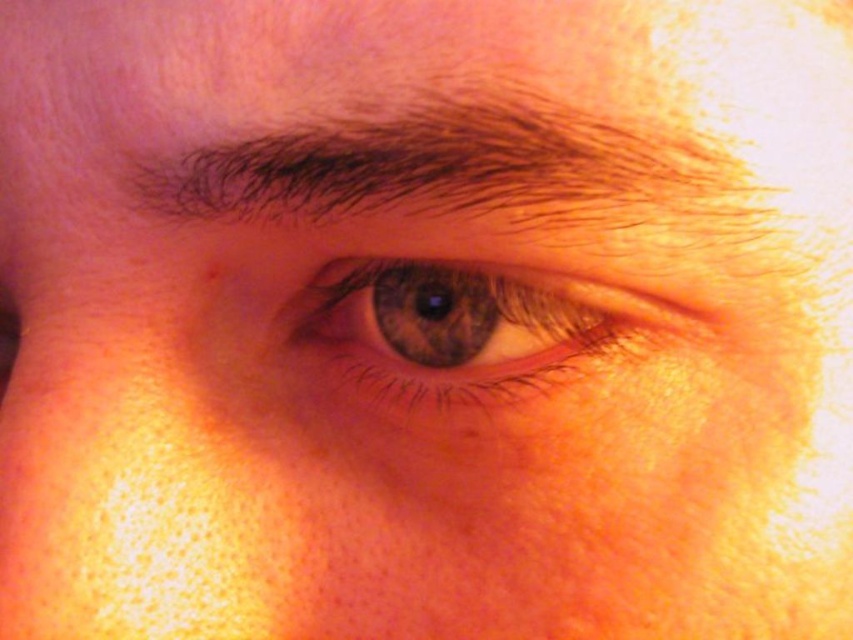
Question: Estimate the real-world distances between objects in this image. Which object is farther from the brown matte eye at center?

Choices:
 (A) brown matte freckle at upper left
 (B) dark brown hair at upper center

Answer: (A)

Question: Considering the real-world distances, which object is farthest from the brown matte freckle at upper left?

Choices:
 (A) brown matte eye at center
 (B) dark brown hair at upper center

Answer: (B)

Question: Is dark brown hair at upper center smaller than brown matte eye at center?

Choices:
 (A) no
 (B) yes

Answer: (A)

Question: Can you confirm if dark brown hair at upper center is bigger than brown matte eye at center?

Choices:
 (A) yes
 (B) no

Answer: (A)

Question: Is brown matte eye at center positioned in front of brown matte freckle at upper left?

Choices:
 (A) yes
 (B) no

Answer: (A)

Question: Among these objects, which one is farthest from the camera?

Choices:
 (A) brown matte freckle at upper left
 (B) brown matte eye at center

Answer: (A)